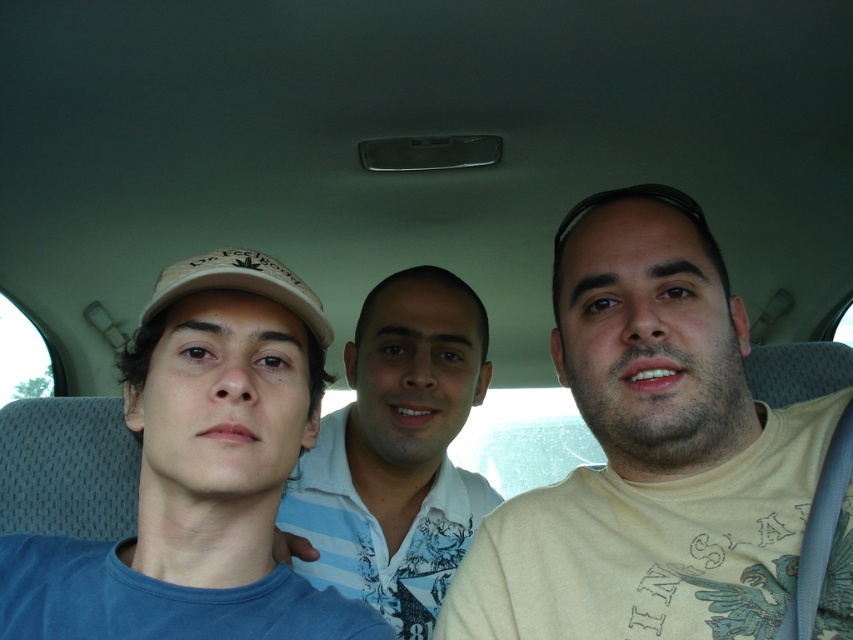
Question: Is white striped shirt at center above white matte baseball cap at center?

Choices:
 (A) yes
 (B) no

Answer: (B)

Question: Can you confirm if blue cotton shirt at left is thinner than white striped shirt at center?

Choices:
 (A) no
 (B) yes

Answer: (A)

Question: Based on their relative distances, which object is farther from the white striped shirt at center?

Choices:
 (A) white matte baseball cap at center
 (B) beige cotton shirt at center
 (C) blue cotton shirt at left

Answer: (A)

Question: Which point is closer to the camera?

Choices:
 (A) blue cotton shirt at left
 (B) white striped shirt at center

Answer: (A)

Question: Which point is farther to the camera?

Choices:
 (A) (668, 298)
 (B) (316, 452)

Answer: (B)

Question: Is blue cotton shirt at left smaller than white matte baseball cap at center?

Choices:
 (A) no
 (B) yes

Answer: (A)